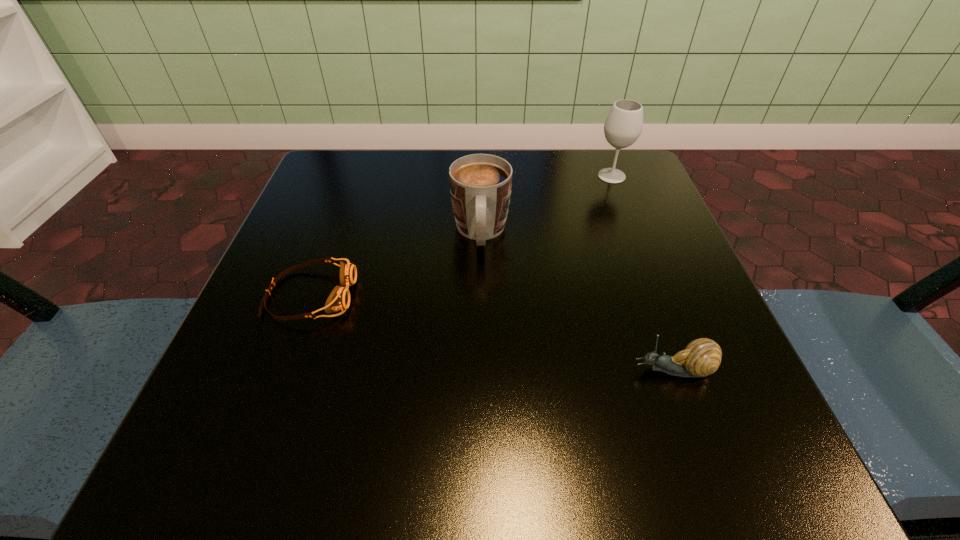
Locate an element on the screen. empty location between the third shortest object and the goggles is located at coordinates (396, 264).

In order to click on vacant area between the mug and the second nearest object in this screenshot , I will do `click(396, 264)`.

In order to click on vacant area that lies between the escargot and the third object from right to left in this screenshot , I will do 577,302.

At what (x,y) coordinates should I click in order to perform the action: click on empty space between the mug and the nearest object. Please return your answer as a coordinate pair (x, y). Looking at the image, I should click on (577, 302).

At what (x,y) coordinates should I click in order to perform the action: click on vacant area between the third shortest object and the shortest object. Please return your answer as a coordinate pair (x, y). Looking at the image, I should click on (396, 264).

Where is `vacant point located between the goggles and the second farthest object`? Image resolution: width=960 pixels, height=540 pixels. vacant point located between the goggles and the second farthest object is located at coordinates (396, 264).

You are a GUI agent. You are given a task and a screenshot of the screen. Output one action in this format:
    pyautogui.click(x=<x>, y=<y>)
    Task: Click on the vacant space that is in between the nearest object and the leftmost object
    
    Given the screenshot: What is the action you would take?
    pyautogui.click(x=492, y=333)

You are a GUI agent. You are given a task and a screenshot of the screen. Output one action in this format:
    pyautogui.click(x=<x>, y=<y>)
    Task: Click on the vacant area that lies between the goggles and the escargot
    This screenshot has height=540, width=960.
    Given the screenshot: What is the action you would take?
    pyautogui.click(x=492, y=333)

Select which object appears as the second closest to the leftmost object. Please provide its 2D coordinates. Your answer should be formatted as a tuple, i.e. [(x, y)], where the tuple contains the x and y coordinates of a point satisfying the conditions above.

[(701, 357)]

Identify the location of object that is the third closest to the mug. This screenshot has width=960, height=540. coord(701,357).